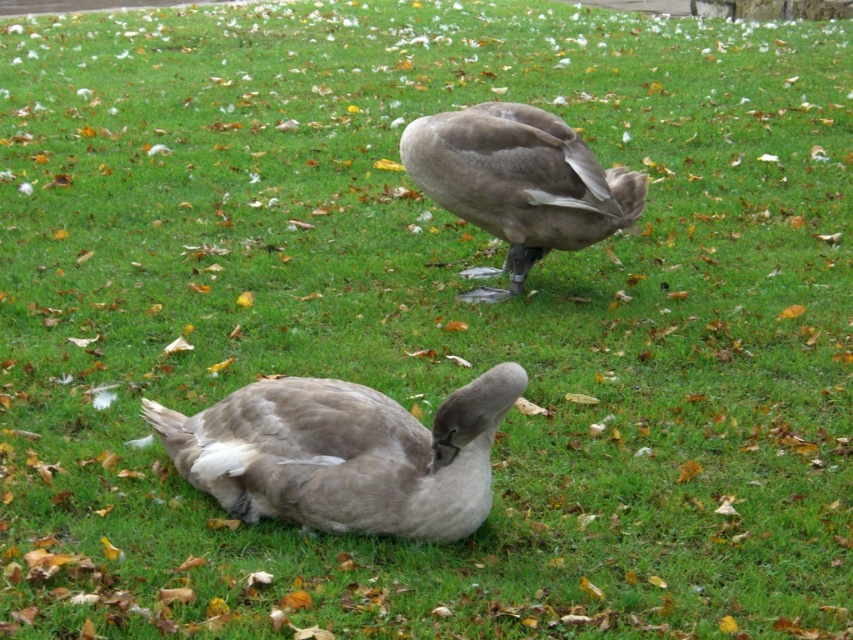
You are a wildlife photographer aiming to capture a photo of the gray matte duck at lower left and the gray matte duck at center. Based on their positions, which duck is positioned lower in the image?

The gray matte duck at lower left is positioned lower in the image than the gray matte duck at center because it is located below it.

You are a birdwatcher observing two gray matte ducks in a grassy area. You notice the gray matte duck at lower left and the gray matte duck at center. Which one is located more to the left?

The gray matte duck at lower left is positioned on the left side of gray matte duck at center, so it is more to the left.